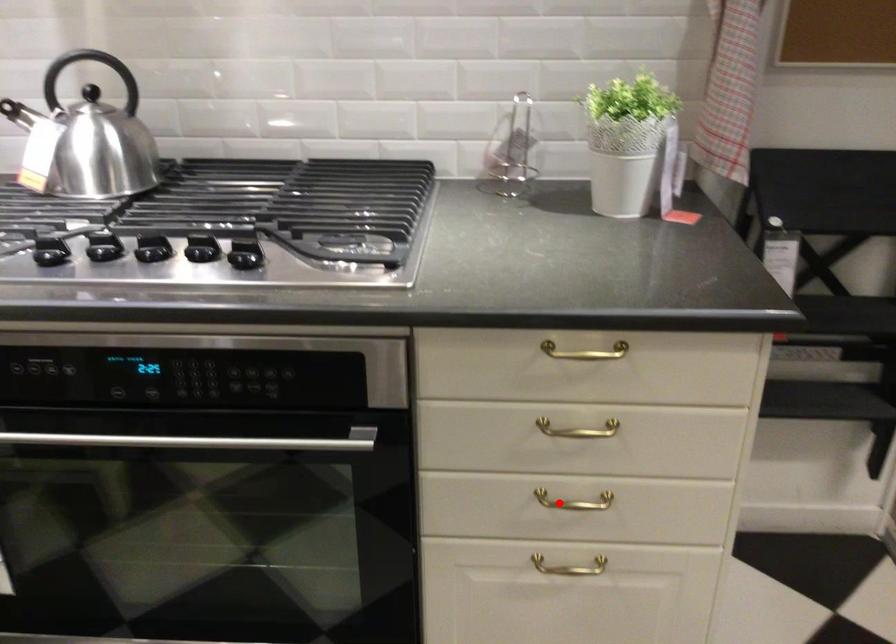
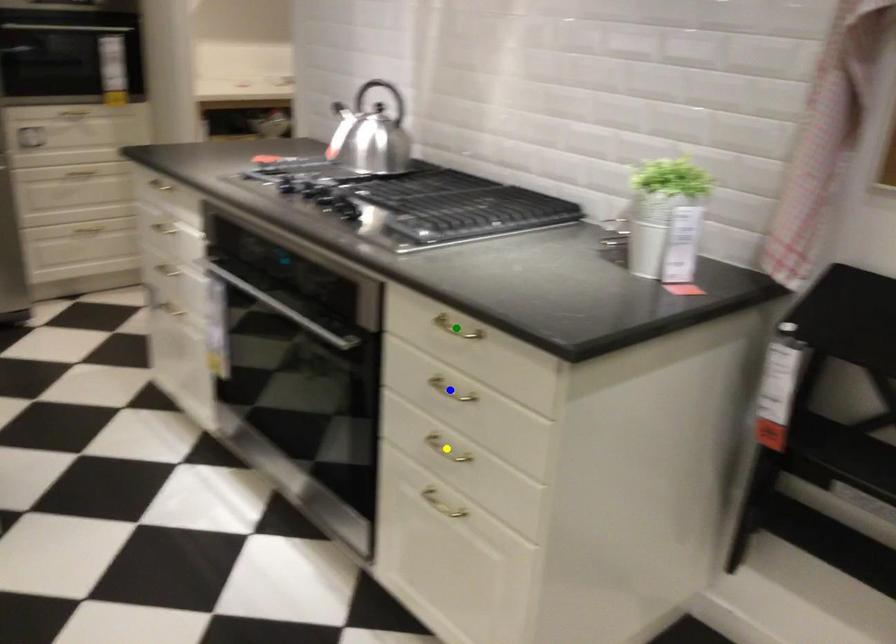
Question: I am providing you with two images of the same scene from different viewpoints. A red point is marked on the first image. You are given multiple points on the second image. Can you choose the point in image 2 that corresponds to the point in image 1?

Choices:
 (A) yellow point
 (B) blue point
 (C) green point

Answer: (A)